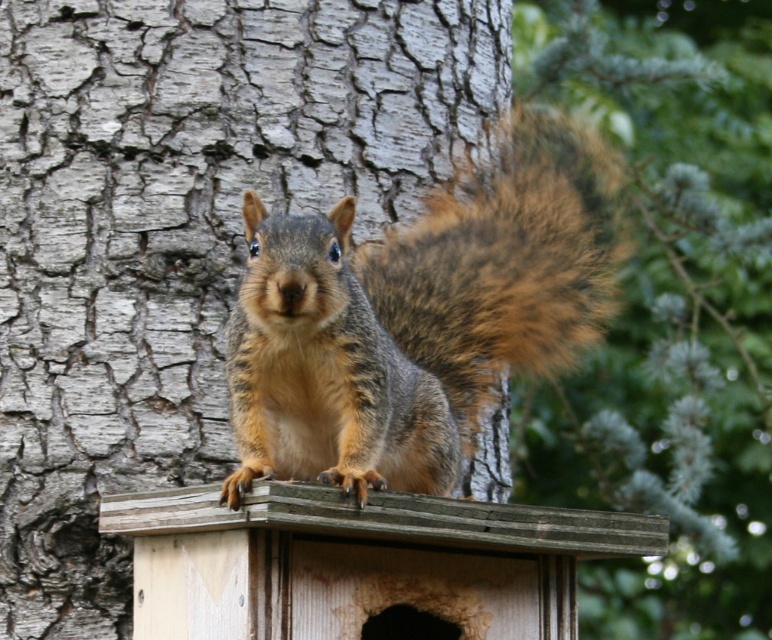
Question: Which object is positioned closest to the brown textured fur at upper center?

Choices:
 (A) wooden bird feeder at center
 (B) gray rough bark tree trunk at center

Answer: (B)

Question: Is gray rough bark tree trunk at center bigger than brown textured fur at upper center?

Choices:
 (A) no
 (B) yes

Answer: (A)

Question: Is brown textured fur at upper center behind wooden bird feeder at center?

Choices:
 (A) yes
 (B) no

Answer: (A)

Question: Does gray rough bark tree trunk at center have a larger size compared to brown fur squirrel at center?

Choices:
 (A) yes
 (B) no

Answer: (A)

Question: Which object is the closest to the brown fur squirrel at center?

Choices:
 (A) brown textured fur at upper center
 (B) wooden bird feeder at center

Answer: (B)

Question: Which object is positioned closest to the gray rough bark tree trunk at center?

Choices:
 (A) brown fur squirrel at center
 (B) wooden bird feeder at center
 (C) brown textured fur at upper center

Answer: (A)